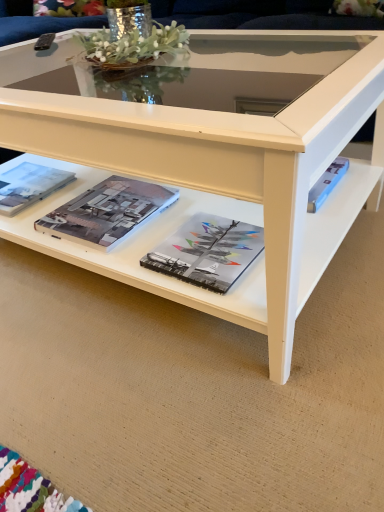
This screenshot has width=384, height=512. I want to click on free point above matte hardcover book at center, positioned as the 3th magazine in left-to-right order (from a real-world perspective), so click(x=208, y=243).